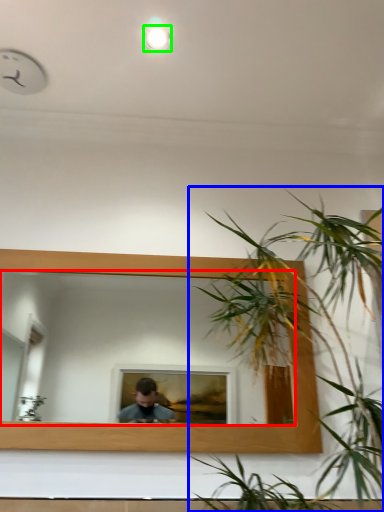
Question: Considering the real-world distances, which object is closest to mirror (highlighted by a red box)? houseplant (highlighted by a blue box) or light (highlighted by a green box).

Choices:
 (A) houseplant
 (B) light

Answer: (A)